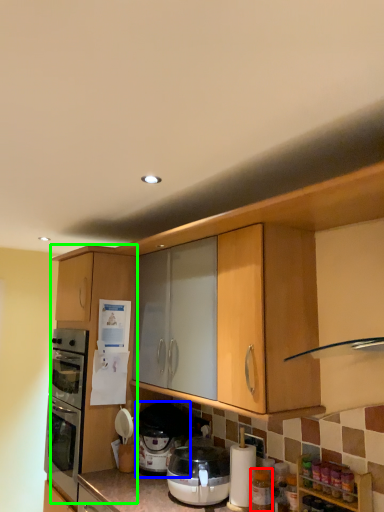
Question: Which is nearer to the bottle (highlighted by a red box)? pressure cooker (highlighted by a blue box) or cabinetry (highlighted by a green box).

Choices:
 (A) pressure cooker
 (B) cabinetry

Answer: (A)